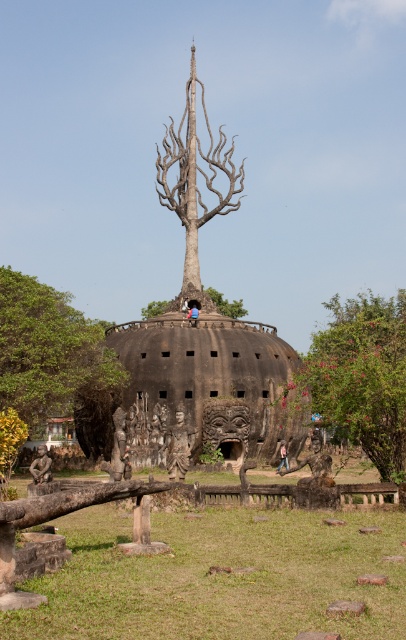
You are planning to place a new bench in the scene. The bench is 2 meters long. You want to place it between the green leafy tree at lower right and the wooden statue at center. Is there enough space between them to fit the bench?

The green leafy tree at lower right is bigger than the wooden statue at center, but the size difference does not provide information about the distance between them. Without knowing the actual distance, it is impossible to determine if the bench will fit.

You are standing at the center of the image looking out. Which object, the green leafy tree at lower right or the dark brown wooden statue at lower left, is positioned higher from the ground?

The green leafy tree at lower right is positioned higher from the ground than the dark brown wooden statue at lower left according to the description.

You are standing at the entrance of this architectural site and want to take a photo that includes both the green leafy tree at lower right and the wooden statue at center. Based on their positions, will the tree appear in front of or behind the wooden statue in the photo?

The green leafy tree at lower right is located above the wooden statue at center, so in the photo, the tree will appear behind the wooden statue.